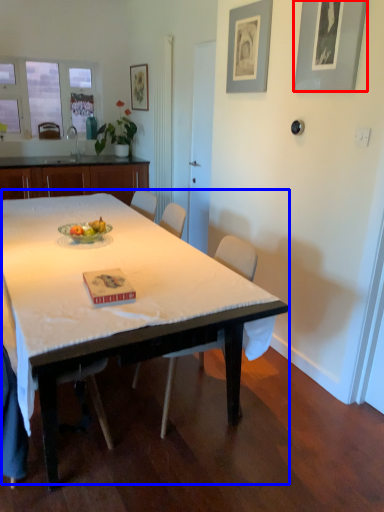
Question: Which point is closer to the camera, picture frame (highlighted by a red box) or table (highlighted by a blue box)?

Choices:
 (A) picture frame
 (B) table

Answer: (B)